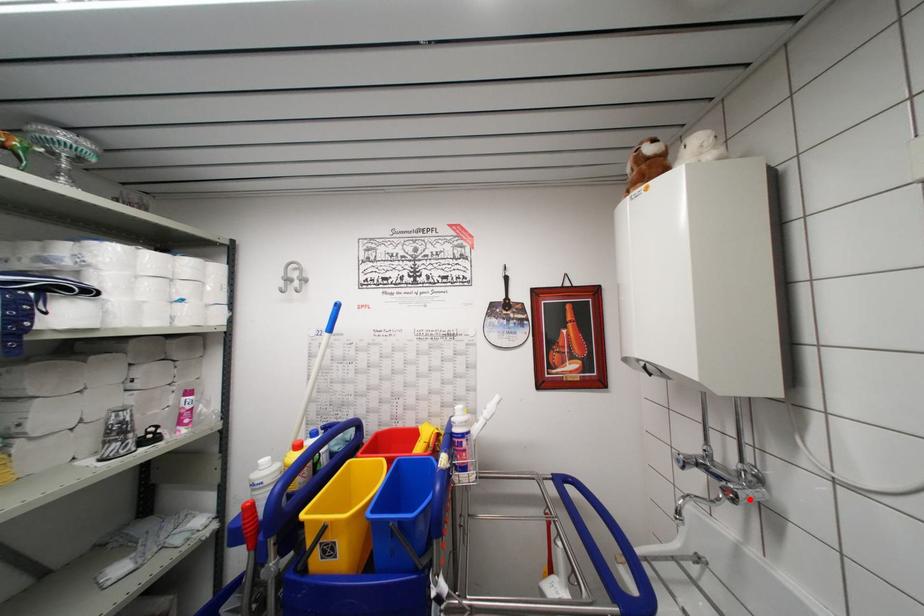
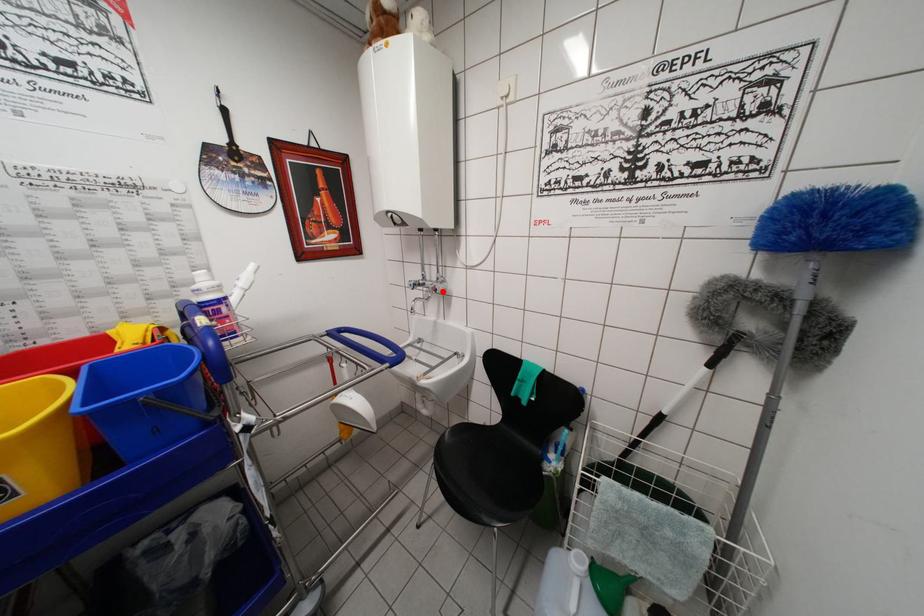
I am providing you with two images of the same scene from different viewpoints. A red point is marked on the first image and another point is marked on the second image. Is the red point in image1 aligned with the point shown in image2?

Yes